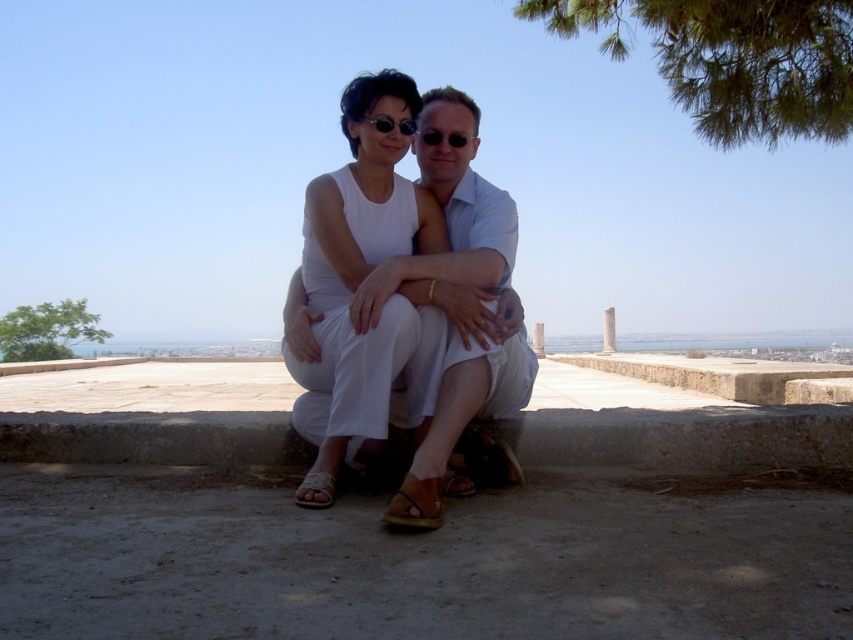
You are a photographer taking a picture of the two people sitting on the stone ledge. You notice the leather sandal at lower center and the matte black sunglasses at center. Which object is taller in the photo?

The leather sandal at lower center is taller than the matte black sunglasses at center.